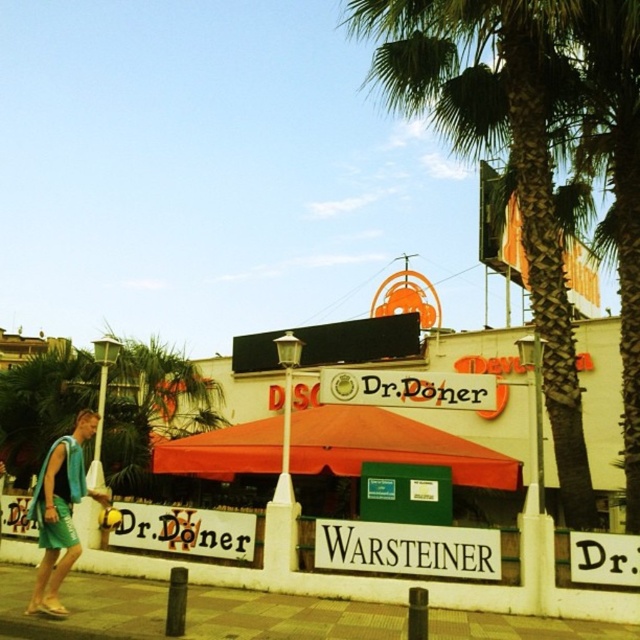
Question: Which point is closer to the camera taking this photo?

Choices:
 (A) (442, 625)
 (B) (61, 477)

Answer: (A)

Question: Where is green leafy palm tree at upper center located in relation to green fabric towel at lower left in the image?

Choices:
 (A) left
 (B) right

Answer: (B)

Question: Which object is positioned closest to the green fabric towel at lower left?

Choices:
 (A) brown brick pavement at lower center
 (B) green leafy palm tree at upper center

Answer: (A)

Question: Which point is closer to the camera?

Choices:
 (A) (451, 52)
 (B) (84, 419)

Answer: (B)

Question: Can you confirm if green leafy palm tree at upper center is bigger than brown brick pavement at lower center?

Choices:
 (A) no
 (B) yes

Answer: (B)

Question: Can you confirm if green leafy palm tree at upper center is wider than green fabric towel at lower left?

Choices:
 (A) yes
 (B) no

Answer: (A)